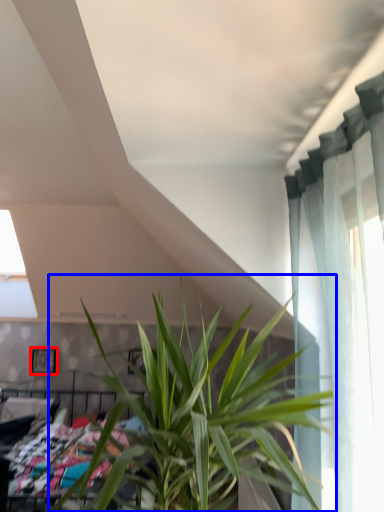
Question: Which object is further to the camera taking this photo, picture frame (highlighted by a red box) or houseplant (highlighted by a blue box)?

Choices:
 (A) picture frame
 (B) houseplant

Answer: (A)